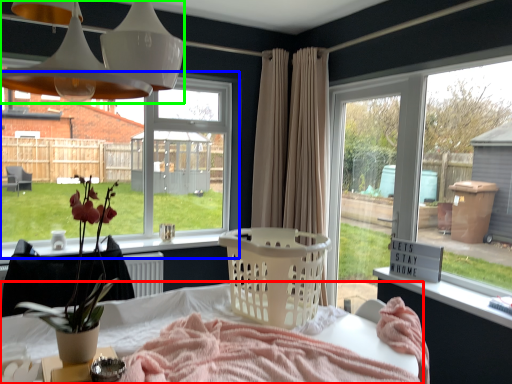
Question: Which is nearer to the table (highlighted by a red box)? window (highlighted by a blue box) or light fixture (highlighted by a green box).

Choices:
 (A) window
 (B) light fixture

Answer: (B)